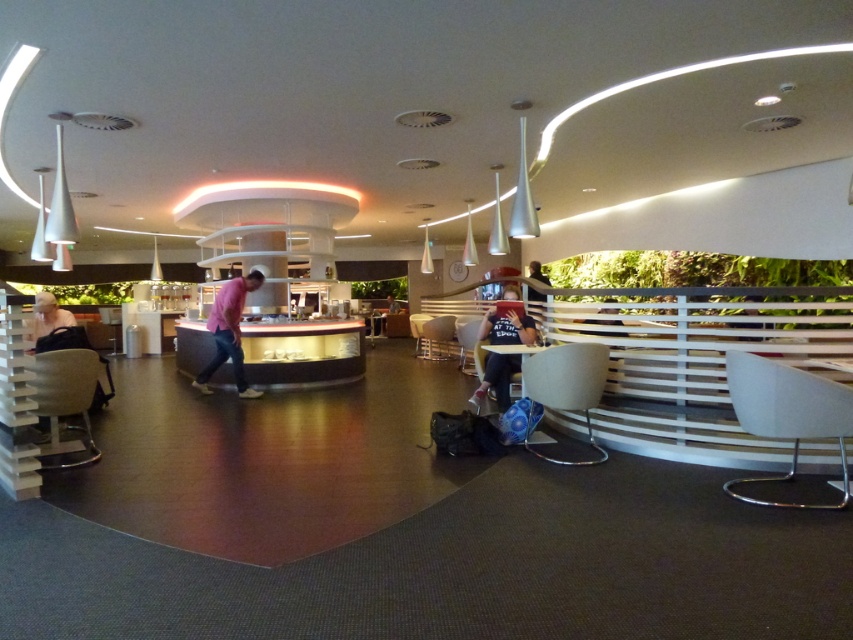
From the picture: You are a fashion designer observing a mannequin in the lounge area. The mannequin is wearing a matte black shirt at center and dark blue jeans at center. Which clothing item has a greater width?

The matte black shirt at center has a greater width than the dark blue jeans at center.

You are a customer in the lounge and want to choose between the pink cotton shirt at center and the matte black shirt at center. Which shirt is positioned to the left when facing the display counter?

The pink cotton shirt at center is to the left of the matte black shirt at center when facing the display counter.